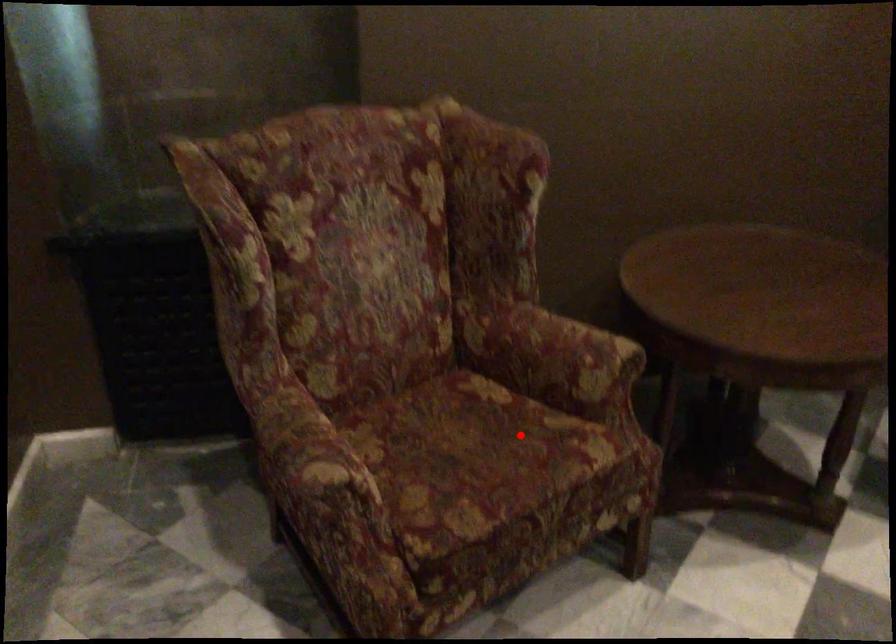
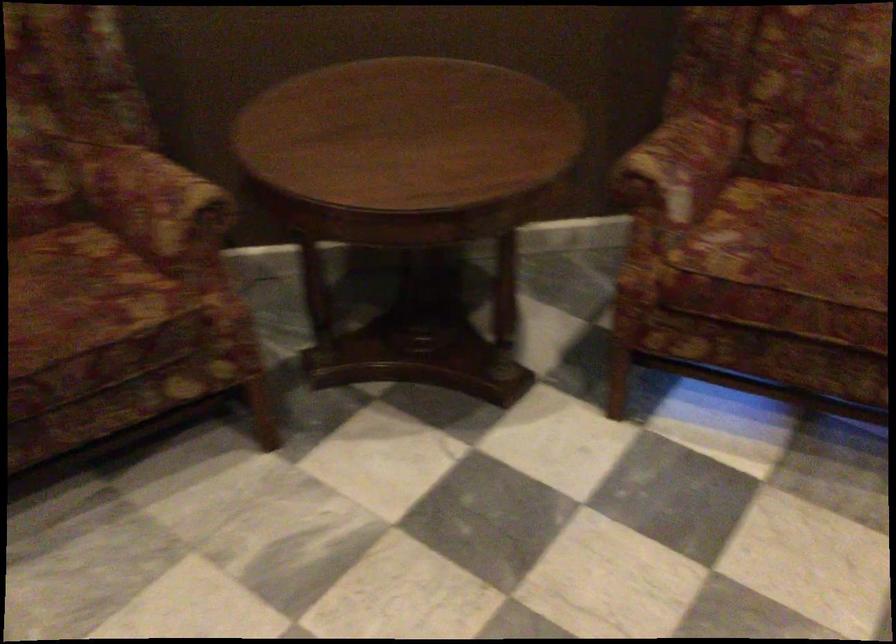
Question: A red point is marked in image1. In image2, is the corresponding 3D point closer to the camera or farther? Reply with the corresponding letter.

Choices:
 (A) The corresponding 3D point is closer.
 (B) The corresponding 3D point is farther.

Answer: (A)